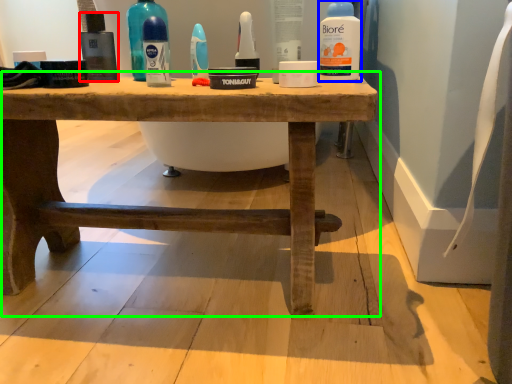
Question: Which object is positioned closest to mouthwash (highlighted by a red box)? Select from cleaning product (highlighted by a blue box) and table (highlighted by a green box).

Choices:
 (A) cleaning product
 (B) table

Answer: (B)